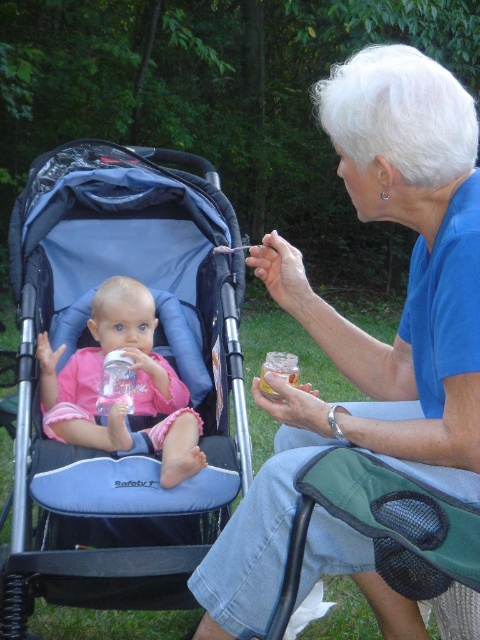
You are a photographer trying to capture a closeup of the pink fabric baby at center while ensuring the blue fabric stroller at upper left is still visible in the frame. Given their sizes, which object should you focus on to include both in the shot?

The blue fabric stroller at upper left is wider than the pink fabric baby at center, so focusing on the stroller while positioning the baby within its frame will ensure both are visible.

Based on the coordinates provided, where is the blue fabric stroller at left located in the image?

The blue fabric stroller at left is located at the coordinates point (157, 353) in the image.

You are a photographer trying to capture a photo of the blue fabric stroller at left and the blue fabric stroller at upper left. From the photographer perspective, which stroller is positioned further to the left?

The blue fabric stroller at left is positioned further to the left compared to the blue fabric stroller at upper left.